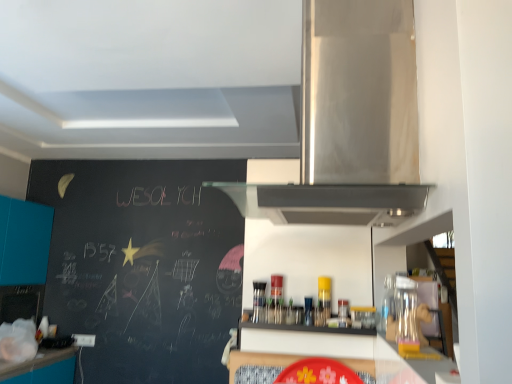
The width and height of the screenshot is (512, 384). Describe the element at coordinates (352, 121) in the screenshot. I see `stainless steel range hood at upper center` at that location.

Locate an element on the screen. teal matte cabinet at left is located at coordinates (24, 241).

How distant is black matte shelf at center from teal matte cabinet at left?

black matte shelf at center and teal matte cabinet at left are 2.83 meters apart from each other.

Are black matte shelf at center and teal matte cabinet at left beside each other?

They are not placed beside each other.

Is black matte shelf at center taller or shorter than teal matte cabinet at left?

Considering their sizes, black matte shelf at center has less height than teal matte cabinet at left.

From a real-world perspective, does black matte shelf at center stand above teal matte cabinet at left?

No, from a real-world perspective, black matte shelf at center is not above teal matte cabinet at left.

Who is bigger, stainless steel range hood at upper center or teal matte cabinet at left?

Bigger between the two is teal matte cabinet at left.

Considering the positions of objects stainless steel range hood at upper center and teal matte cabinet at left in the image provided, who is more to the left, stainless steel range hood at upper center or teal matte cabinet at left?

teal matte cabinet at left is more to the left.

Is stainless steel range hood at upper center oriented away from teal matte cabinet at left?

No, teal matte cabinet at left is not at the back of stainless steel range hood at upper center.

From the image's perspective, who appears lower, stainless steel range hood at upper center or teal matte cabinet at left?

From the image's view, teal matte cabinet at left is below.

Is teal matte cabinet at left far from stainless steel range hood at upper center?

That's right, there is a large distance between teal matte cabinet at left and stainless steel range hood at upper center.

Is teal matte cabinet at left aimed at stainless steel range hood at upper center?

No, teal matte cabinet at left is not oriented towards stainless steel range hood at upper center.

Measure the distance between teal matte cabinet at left and stainless steel range hood at upper center.

They are 3.25 meters apart.

Considering the relative positions of teal matte cabinet at left and stainless steel range hood at upper center in the image provided, is teal matte cabinet at left in front of stainless steel range hood at upper center?

No, teal matte cabinet at left is behind stainless steel range hood at upper center.

From the image's perspective, which is below, teal matte cabinet at left or black matte shelf at center?

teal matte cabinet at left is shown below in the image.

Is teal matte cabinet at left turned away from black matte shelf at center?

No, teal matte cabinet at left is not facing the opposite direction of black matte shelf at center.

Can you confirm if teal matte cabinet at left is shorter than black matte shelf at center?

No, teal matte cabinet at left is not shorter than black matte shelf at center.

Does teal matte cabinet at left have a larger size compared to black matte shelf at center?

Yes.

You are a GUI agent. You are given a task and a screenshot of the screen. Output one action in this format:
    pyautogui.click(x=<x>, y=<y>)
    Task: Click on the home appliance above the black matte shelf at center (from the image's perspective)
    
    Given the screenshot: What is the action you would take?
    pyautogui.click(x=352, y=121)

What's the angular difference between black matte shelf at center and stainless steel range hood at upper center's facing directions?

The angular difference between black matte shelf at center and stainless steel range hood at upper center is 90.4 degrees.

Is black matte shelf at center looking in the opposite direction of stainless steel range hood at upper center?

black matte shelf at center is not turned away from stainless steel range hood at upper center.

Does black matte shelf at center appear on the right side of stainless steel range hood at upper center?

Yes.

Considering the positions of point (403, 63) and point (295, 326), is point (403, 63) closer or farther from the camera than point (295, 326)?

Point (403, 63) is positioned closer to the camera compared to point (295, 326).

Who is shorter, stainless steel range hood at upper center or black matte shelf at center?

black matte shelf at center is shorter.

From a real-world perspective, is stainless steel range hood at upper center on black matte shelf at center?

Indeed, from a real-world perspective, stainless steel range hood at upper center stands above black matte shelf at center.

Where is `shelf that is on the right side of teal matte cabinet at left`? This screenshot has height=384, width=512. shelf that is on the right side of teal matte cabinet at left is located at coordinates (302, 327).

Locate an element on the screen. The image size is (512, 384). cabinetry below the stainless steel range hood at upper center (from a real-world perspective) is located at coordinates [24, 241].

From the image, which object appears to be farther from stainless steel range hood at upper center, black matte shelf at center or teal matte cabinet at left?

The object further to stainless steel range hood at upper center is teal matte cabinet at left.

Based on their spatial positions, is stainless steel range hood at upper center or teal matte cabinet at left closer to black matte shelf at center?

stainless steel range hood at upper center is closer to black matte shelf at center.

When comparing their distances from teal matte cabinet at left, does black matte shelf at center or stainless steel range hood at upper center seem further?

stainless steel range hood at upper center is positioned further to the anchor teal matte cabinet at left.

Estimate the real-world distances between objects in this image. Which object is further from stainless steel range hood at upper center, teal matte cabinet at left or black matte shelf at center?

teal matte cabinet at left.

From the image, which object appears to be farther from teal matte cabinet at left, stainless steel range hood at upper center or black matte shelf at center?

Based on the image, stainless steel range hood at upper center appears to be further to teal matte cabinet at left.

From the picture: Looking at the image, which one is located closer to black matte shelf at center, teal matte cabinet at left or stainless steel range hood at upper center?

stainless steel range hood at upper center is positioned closer to the anchor black matte shelf at center.

The height and width of the screenshot is (384, 512). What are the coordinates of `home appliance between teal matte cabinet at left and black matte shelf at center from left to right` in the screenshot? It's located at (352, 121).